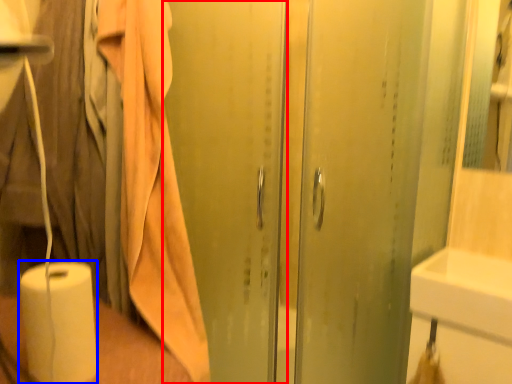
Question: Which object is closer to the camera taking this photo, screen door (highlighted by a red box) or paper towel (highlighted by a blue box)?

Choices:
 (A) screen door
 (B) paper towel

Answer: (B)